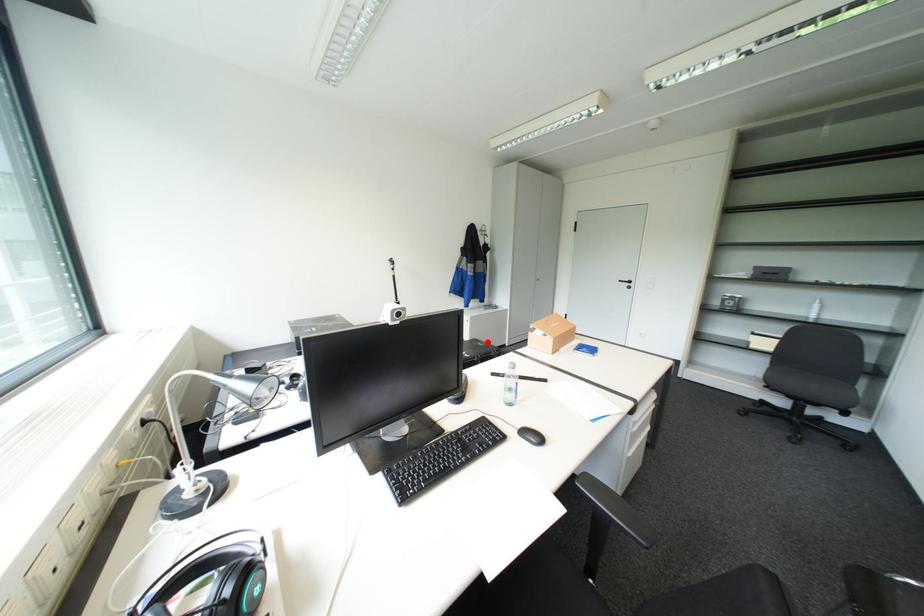
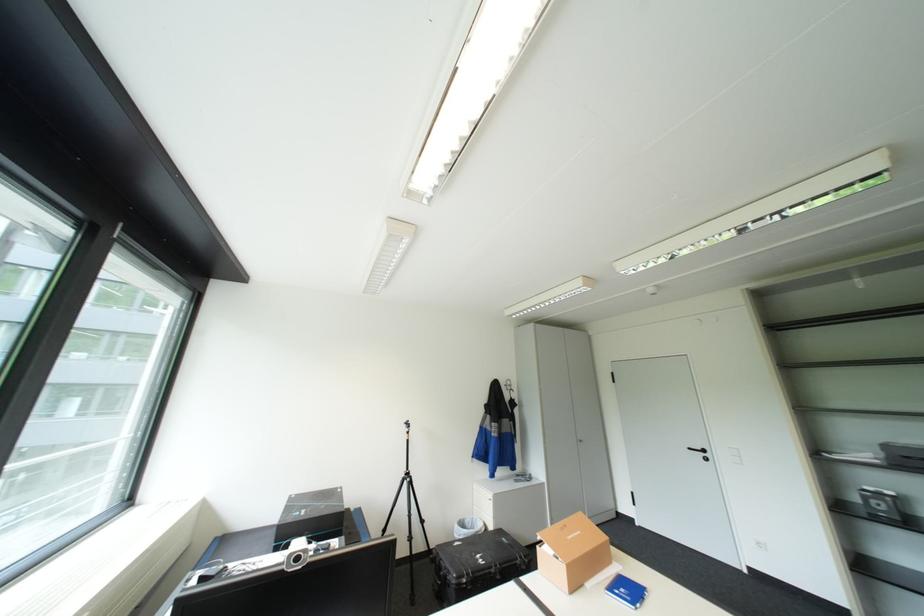
Question: I am providing you with two images of the same scene from different viewpoints. Given a red point in image1, look at the same physical point in image2. Is it:

Choices:
 (A) Closer to the viewpoint
 (B) Farther from the viewpoint

Answer: (B)